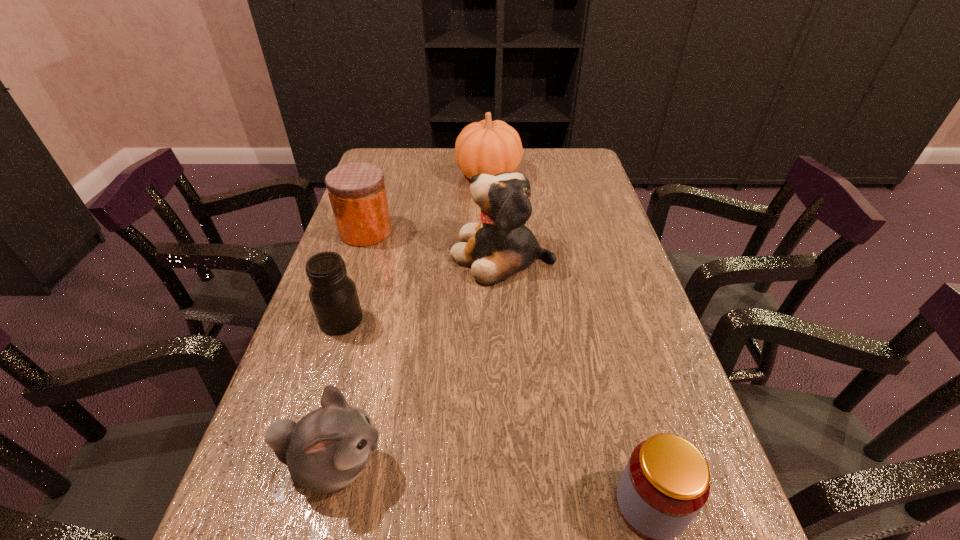
At what (x,y) coordinates should I click in order to perform the action: click on puppy. Please return your answer as a coordinate pair (x, y). Looking at the image, I should click on (500, 245).

At what (x,y) coordinates should I click in order to perform the action: click on the farthest object. Please return your answer as a coordinate pair (x, y). The image size is (960, 540). Looking at the image, I should click on (489, 147).

Identify the location of the farthest jar. (357, 193).

Identify the location of the second farthest jar. This screenshot has height=540, width=960. coord(333,295).

Where is `hamster`? hamster is located at coordinates (325, 451).

At what (x,y) coordinates should I click in order to perform the action: click on vacant region located at the face of the puppy. Please return your answer as a coordinate pair (x, y). The height and width of the screenshot is (540, 960). Looking at the image, I should click on (432, 254).

The image size is (960, 540). What are the coordinates of `free space located at the face of the puppy` in the screenshot? It's located at (417, 254).

You are a GUI agent. You are given a task and a screenshot of the screen. Output one action in this format:
    pyautogui.click(x=<x>, y=<y>)
    Task: Click on the free region located 0.180m at the face of the puppy
    The width and height of the screenshot is (960, 540).
    Given the screenshot: What is the action you would take?
    pyautogui.click(x=382, y=254)

This screenshot has height=540, width=960. Find the location of `free space located 0.060m on the front of the pumpkin`. free space located 0.060m on the front of the pumpkin is located at coordinates (490, 202).

This screenshot has height=540, width=960. Find the location of `free space located on the right of the farthest jar`. free space located on the right of the farthest jar is located at coordinates 511,231.